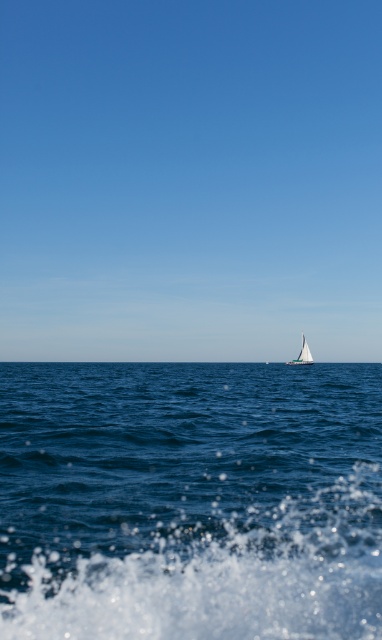
Question: Is blue liquid water at lower center behind white sailboat at center?

Choices:
 (A) no
 (B) yes

Answer: (A)

Question: Is blue liquid water at lower center behind white sailboat at center?

Choices:
 (A) yes
 (B) no

Answer: (B)

Question: Which object is closer to the camera taking this photo?

Choices:
 (A) white sailboat at center
 (B) blue liquid water at lower center

Answer: (B)

Question: Which object appears closest to the camera in this image?

Choices:
 (A) blue liquid water at lower center
 (B) white sailboat at center

Answer: (A)

Question: Among these objects, which one is nearest to the camera?

Choices:
 (A) white sailboat at center
 (B) blue liquid water at lower center

Answer: (B)

Question: Is blue liquid water at lower center below white sailboat at center?

Choices:
 (A) no
 (B) yes

Answer: (A)